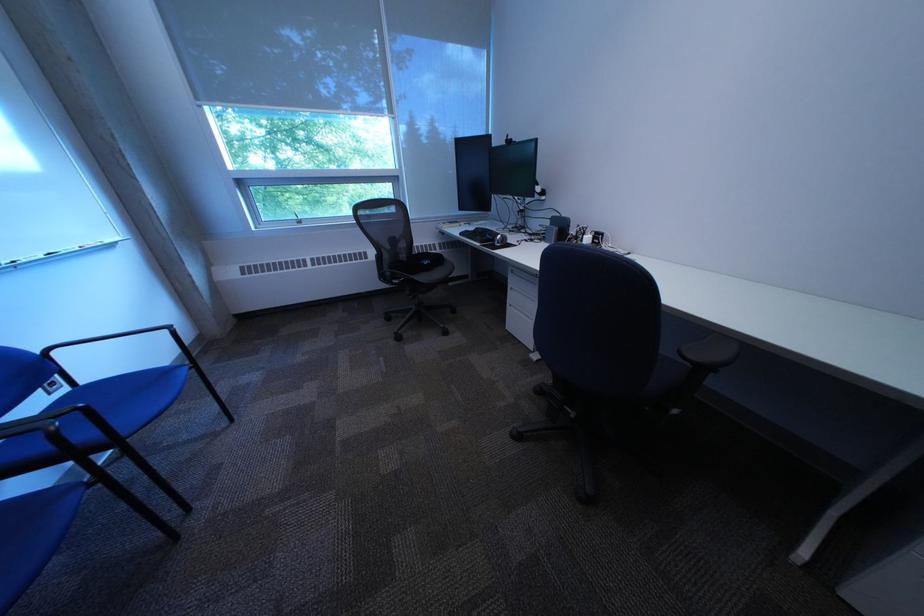
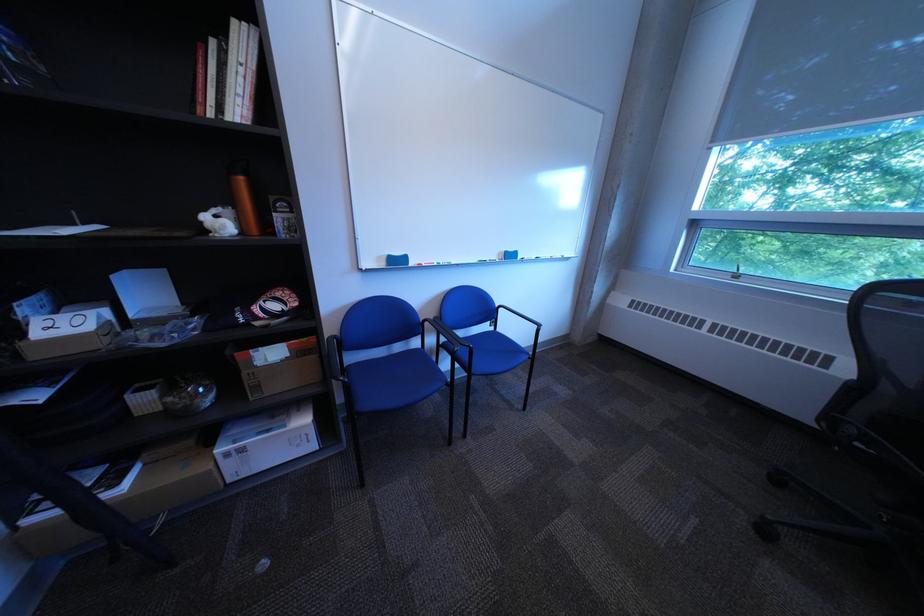
How did the camera likely rotate?

The camera rotated toward left-down.